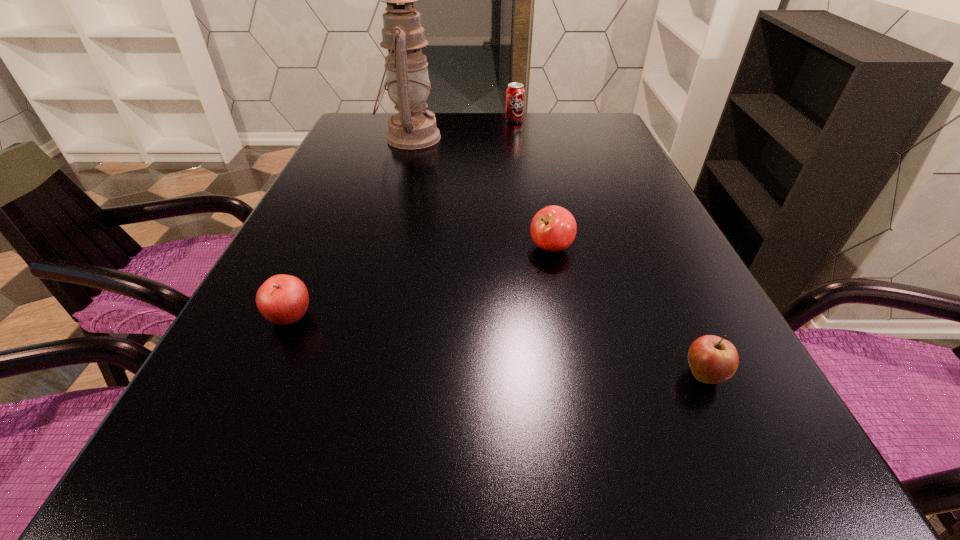
Find the location of a particular element. The width and height of the screenshot is (960, 540). oil lamp is located at coordinates (407, 80).

Where is `soda`? Image resolution: width=960 pixels, height=540 pixels. soda is located at coordinates (515, 93).

Identify the location of the second apple from right to left. The width and height of the screenshot is (960, 540). (553, 228).

Identify the location of the third farthest object. (553, 228).

Where is `the leftmost apple`? The height and width of the screenshot is (540, 960). the leftmost apple is located at coordinates (283, 299).

This screenshot has width=960, height=540. In order to click on the second nearest apple in this screenshot , I will do `click(283, 299)`.

Find the location of `the nearest apple`. the nearest apple is located at coordinates (712, 359).

The height and width of the screenshot is (540, 960). In order to click on the nearest object in this screenshot , I will do `click(712, 359)`.

Identify the location of free spot located on the front of the tallest object. (394, 196).

Where is `vacant space located on the front of the fourth shortest object`? This screenshot has height=540, width=960. vacant space located on the front of the fourth shortest object is located at coordinates (516, 138).